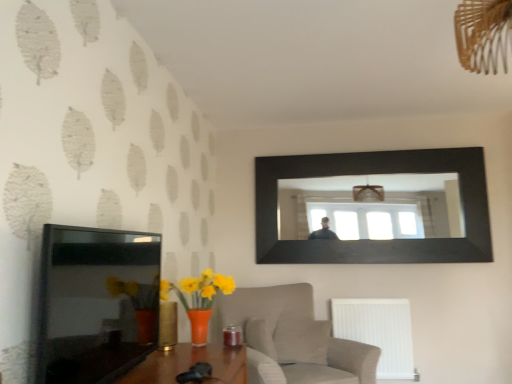
Question: Is white plastic radiator at lower right shorter than black glossy picture frame at upper center, which is the first picture frame in back-to-front order?

Choices:
 (A) yes
 (B) no

Answer: (A)

Question: Can you confirm if white plastic radiator at lower right is bigger than black glossy picture frame at upper center, which is the 2th picture frame in left-to-right order?

Choices:
 (A) yes
 (B) no

Answer: (B)

Question: Does white plastic radiator at lower right have a greater width compared to black glossy picture frame at upper center, which is the first picture frame in back-to-front order?

Choices:
 (A) yes
 (B) no

Answer: (A)

Question: Does white plastic radiator at lower right have a greater height compared to black glossy picture frame at upper center, which is counted as the 2th picture frame, starting from the front?

Choices:
 (A) yes
 (B) no

Answer: (B)

Question: From the image's perspective, is white plastic radiator at lower right under black glossy picture frame at upper center, which is the 2th picture frame in left-to-right order?

Choices:
 (A) yes
 (B) no

Answer: (A)

Question: From a real-world perspective, is black glossy tv at left, placed as the first picture frame when sorted from front to back, positioned above or below black glossy picture frame at upper center, which is the first picture frame in back-to-front order?

Choices:
 (A) below
 (B) above

Answer: (A)

Question: From the image's perspective, is black glossy tv at left, positioned as the first picture frame in left-to-right order, positioned above or below black glossy picture frame at upper center, which is the first picture frame in back-to-front order?

Choices:
 (A) below
 (B) above

Answer: (A)

Question: Which is correct: black glossy tv at left, placed as the first picture frame when sorted from front to back, is inside black glossy picture frame at upper center, which is the 2th picture frame in left-to-right order, or outside of it?

Choices:
 (A) inside
 (B) outside

Answer: (B)

Question: Is point (96, 281) positioned closer to the camera than point (266, 190)?

Choices:
 (A) closer
 (B) farther

Answer: (A)

Question: From their relative heights in the image, would you say black glossy tv at left, the second picture frame when ordered from back to front, is taller or shorter than white plastic radiator at lower right?

Choices:
 (A) tall
 (B) short

Answer: (B)

Question: Considering the positions of point (90, 241) and point (354, 324), is point (90, 241) closer or farther from the camera than point (354, 324)?

Choices:
 (A) closer
 (B) farther

Answer: (A)

Question: Would you say black glossy tv at left, placed as the first picture frame when sorted from front to back, is inside or outside white plastic radiator at lower right?

Choices:
 (A) inside
 (B) outside

Answer: (B)

Question: In the image, is black glossy tv at left, which is the 2th picture frame from right to left, on the left side or the right side of white plastic radiator at lower right?

Choices:
 (A) right
 (B) left

Answer: (B)

Question: From the image's perspective, is textured beige armchair at lower center positioned above or below black glossy picture frame at upper center, which is counted as the 2th picture frame, starting from the front?

Choices:
 (A) above
 (B) below

Answer: (B)

Question: Considering the relative positions of textured beige armchair at lower center and black glossy picture frame at upper center, which is counted as the 2th picture frame, starting from the front, in the image provided, is textured beige armchair at lower center to the left or to the right of black glossy picture frame at upper center, which is counted as the 2th picture frame, starting from the front,?

Choices:
 (A) left
 (B) right

Answer: (A)